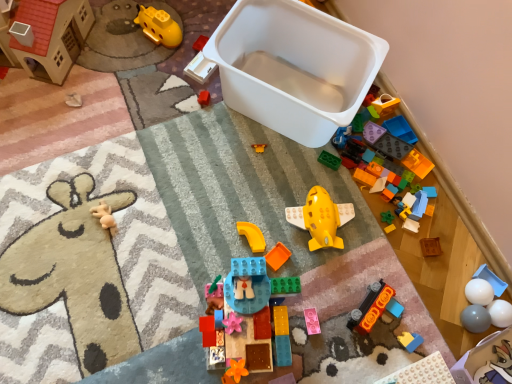
The width and height of the screenshot is (512, 384). I want to click on free space to the back side of matte plastic toy at lower right, which is counted as the 12th toy, starting from the left, so click(x=393, y=284).